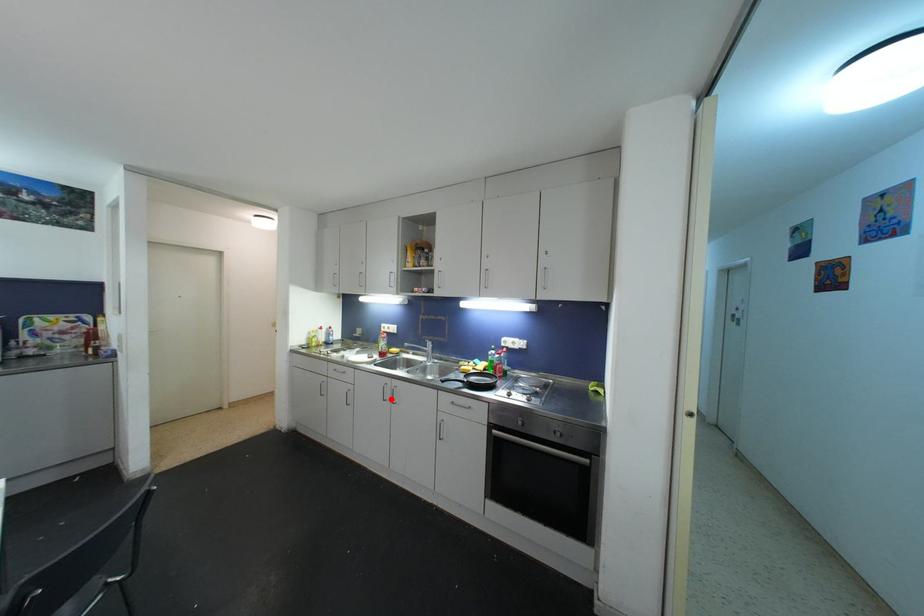
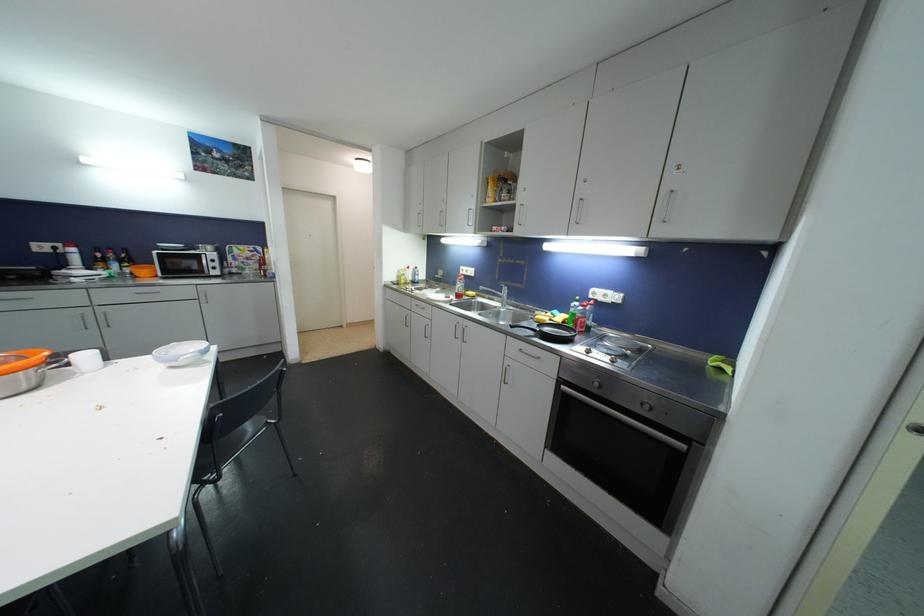
The point at the highlighted location is marked in the first image. Where is the corresponding point in the second image?

(463, 338)